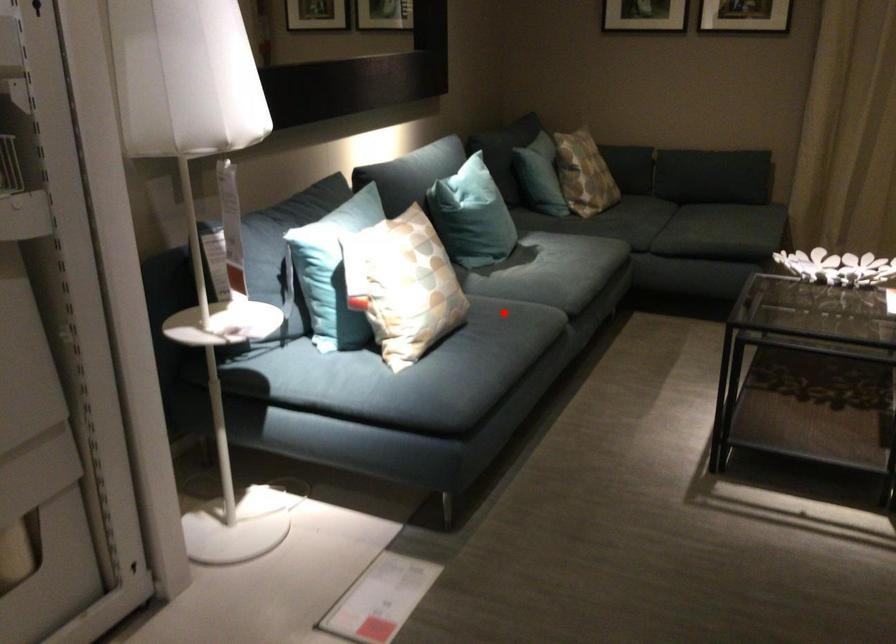
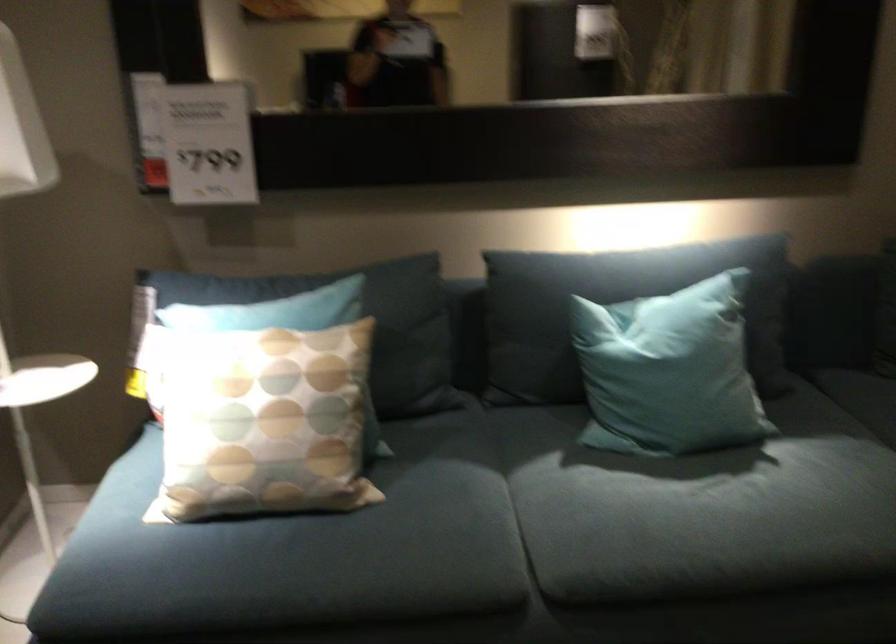
Locate, in the second image, the point that corresponds to the highlighted location in the first image.

(406, 526)